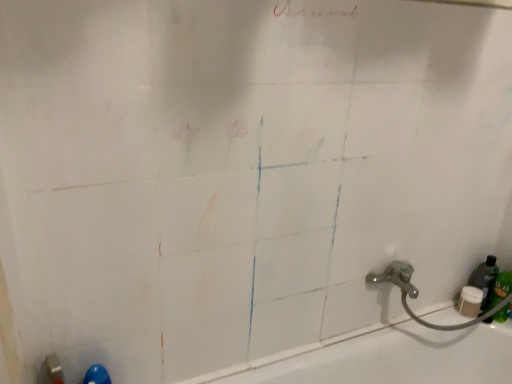
Question: Is white glossy bathtub at lower right closer to camera compared to green matte bottle at lower right?

Choices:
 (A) yes
 (B) no

Answer: (A)

Question: Is white glossy bathtub at lower right positioned with its back to green matte bottle at lower right?

Choices:
 (A) no
 (B) yes

Answer: (A)

Question: Does white glossy bathtub at lower right contain green matte bottle at lower right?

Choices:
 (A) yes
 (B) no

Answer: (B)

Question: Does white glossy bathtub at lower right have a greater height compared to green matte bottle at lower right?

Choices:
 (A) no
 (B) yes

Answer: (B)

Question: Is white glossy bathtub at lower right bigger than green matte bottle at lower right?

Choices:
 (A) no
 (B) yes

Answer: (B)

Question: From a real-world perspective, is white glossy bathtub at lower right on top of green matte bottle at lower right?

Choices:
 (A) yes
 (B) no

Answer: (B)

Question: Can you confirm if green matte bottle at lower right is smaller than white glossy bathtub at lower right?

Choices:
 (A) no
 (B) yes

Answer: (B)

Question: From the image's perspective, is green matte bottle at lower right below white glossy bathtub at lower right?

Choices:
 (A) yes
 (B) no

Answer: (B)

Question: Is white glossy bathtub at lower right inside green matte bottle at lower right?

Choices:
 (A) no
 (B) yes

Answer: (A)

Question: Are green matte bottle at lower right and white glossy bathtub at lower right beside each other?

Choices:
 (A) yes
 (B) no

Answer: (B)

Question: Considering the relative sizes of green matte bottle at lower right and white glossy bathtub at lower right in the image provided, is green matte bottle at lower right thinner than white glossy bathtub at lower right?

Choices:
 (A) yes
 (B) no

Answer: (A)

Question: From a real-world perspective, is green matte bottle at lower right below white glossy bathtub at lower right?

Choices:
 (A) no
 (B) yes

Answer: (A)

Question: From the image's perspective, is white glossy bathtub at lower right positioned above or below green matte bottle at lower right?

Choices:
 (A) below
 (B) above

Answer: (A)